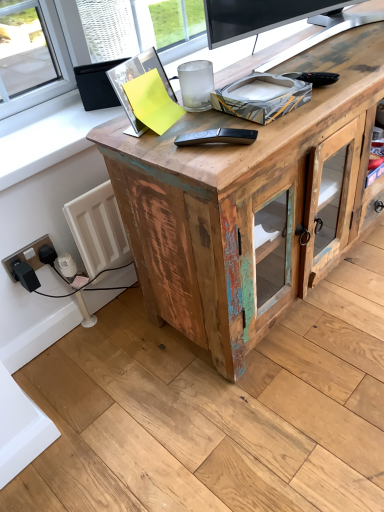
Question: Looking at their shapes, would you say black plastic remote control at center is wider or thinner than weathered wood desk at center?

Choices:
 (A) thin
 (B) wide

Answer: (A)

Question: Considering the positions of point pyautogui.click(x=243, y=130) and point pyautogui.click(x=288, y=153), is point pyautogui.click(x=243, y=130) closer or farther from the camera than point pyautogui.click(x=288, y=153)?

Choices:
 (A) closer
 (B) farther

Answer: (A)

Question: Which of these objects is positioned closest to the black plastic socket at lower left?

Choices:
 (A) weathered wood desk at center
 (B) black plastic remote control at center

Answer: (B)

Question: Estimate the real-world distances between objects in this image. Which object is farther from the weathered wood desk at center?

Choices:
 (A) black plastic socket at lower left
 (B) black plastic remote control at center

Answer: (A)